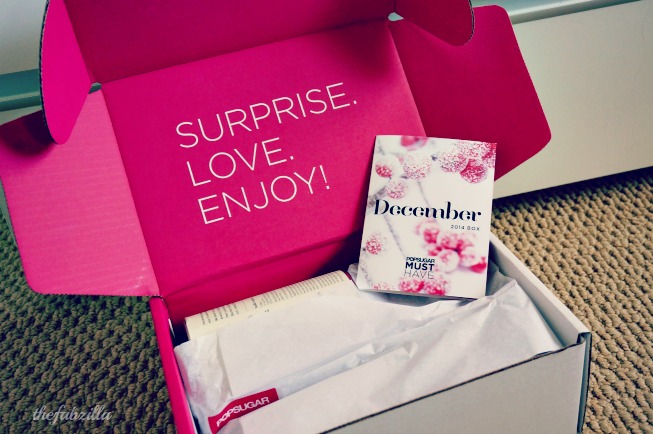
The height and width of the screenshot is (434, 653). In order to click on box in this screenshot , I will do `click(503, 393)`.